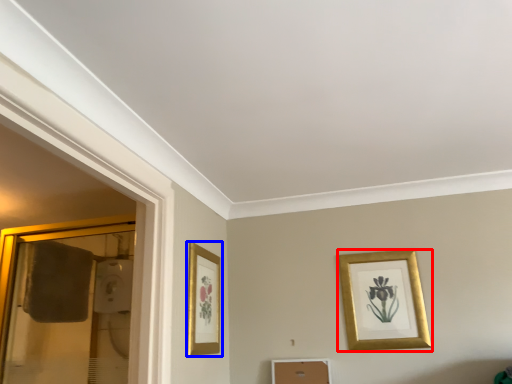
Question: Which object appears closest to the camera in this image, picture frame (highlighted by a red box) or picture frame (highlighted by a blue box)?

Choices:
 (A) picture frame
 (B) picture frame

Answer: (B)